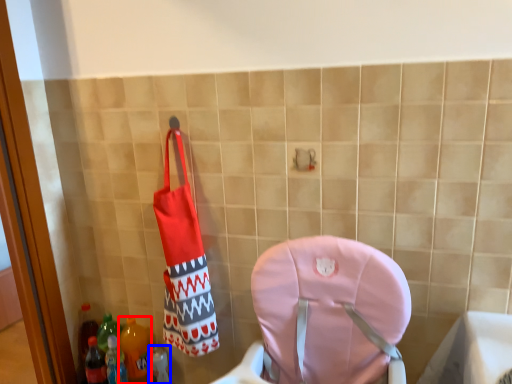
Question: Which object appears closest to the camera in this image, bottle (highlighted by a red box) or bottle (highlighted by a blue box)?

Choices:
 (A) bottle
 (B) bottle

Answer: (A)